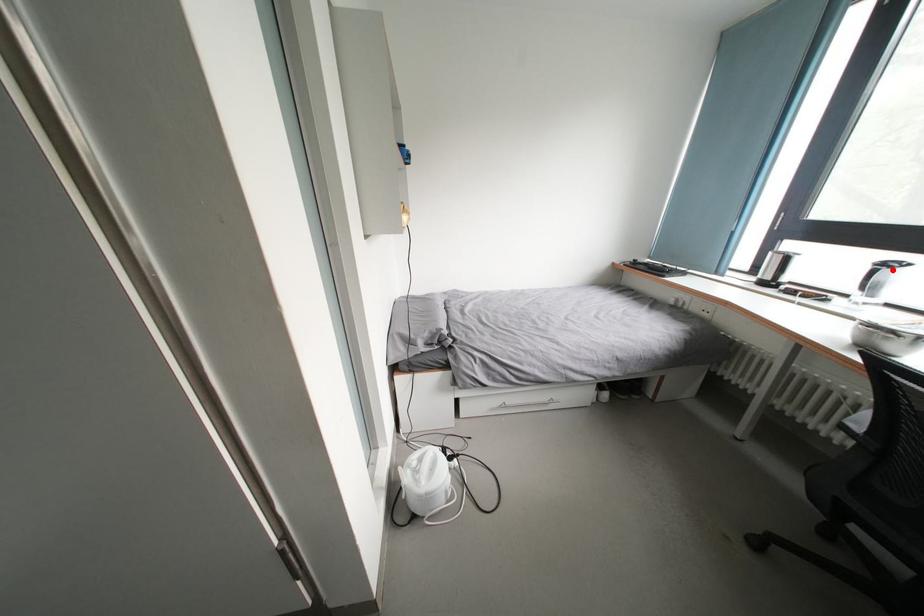
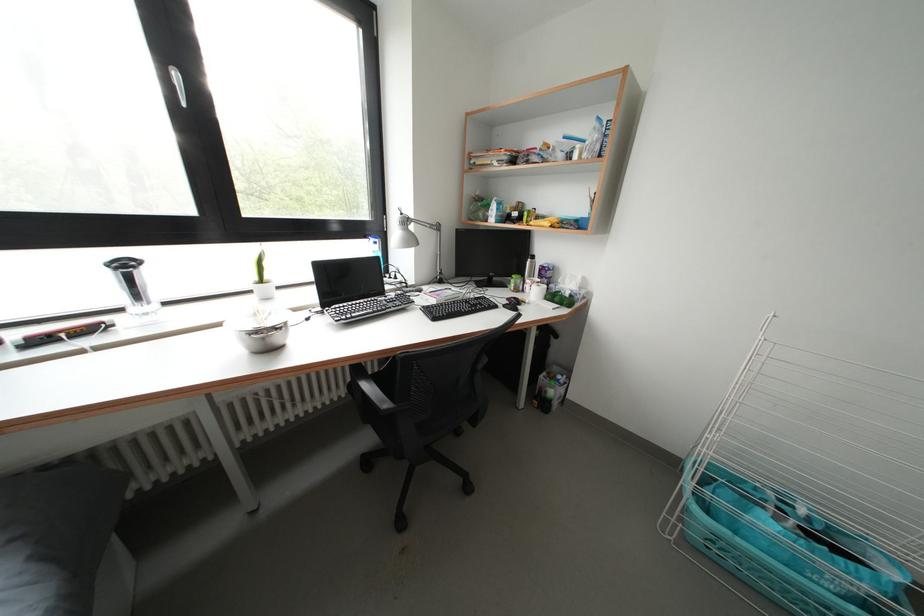
Question: I am providing you with two images of the same scene from different viewpoints. A red point is marked on the first image. Can you still see the location of the red point in image 2?

Choices:
 (A) Yes
 (B) No

Answer: (A)